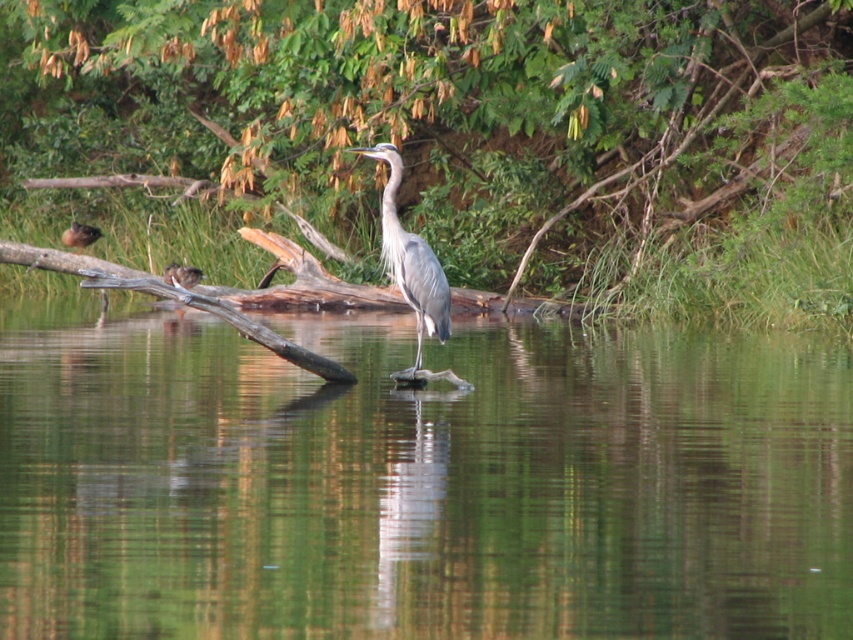
Question: Which of the following is the farthest from the observer?

Choices:
 (A) green leafy tree at upper center
 (B) clear water at center

Answer: (A)

Question: Where is clear water at center located in relation to gray feathered heron at center in the image?

Choices:
 (A) below
 (B) above

Answer: (A)

Question: Is clear water at center to the right of brown fuzzy duckling at left from the viewer's perspective?

Choices:
 (A) yes
 (B) no

Answer: (A)

Question: Is clear water at center above green leafy tree at upper center?

Choices:
 (A) yes
 (B) no

Answer: (B)

Question: Among these objects, which one is farthest from the camera?

Choices:
 (A) green leafy tree at upper center
 (B) gray feathered heron at center
 (C) clear water at center

Answer: (A)

Question: Estimate the real-world distances between objects in this image. Which object is closer to the brown fuzzy duckling at left?

Choices:
 (A) gray feathered heron at center
 (B) clear water at center

Answer: (B)